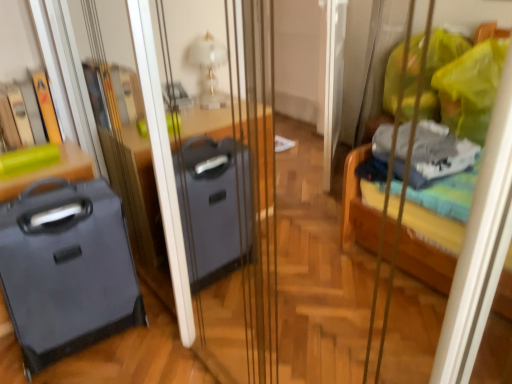
Question: Should I look upward or downward to see matte black suitcase at left?

Choices:
 (A) up
 (B) down

Answer: (B)

Question: Can you confirm if green matte suitcase at left is bigger than matte black suitcase at left?

Choices:
 (A) no
 (B) yes

Answer: (A)

Question: Is green matte suitcase at left positioned beyond the bounds of matte black suitcase at left?

Choices:
 (A) no
 (B) yes

Answer: (B)

Question: From a real-world perspective, does green matte suitcase at left stand above matte black suitcase at left?

Choices:
 (A) yes
 (B) no

Answer: (A)

Question: Considering the relative positions of green matte suitcase at left and matte black suitcase at left in the image provided, is green matte suitcase at left to the left of matte black suitcase at left from the viewer's perspective?

Choices:
 (A) no
 (B) yes

Answer: (B)

Question: Is green matte suitcase at left next to matte black suitcase at left?

Choices:
 (A) no
 (B) yes

Answer: (A)

Question: From the image's perspective, is green matte suitcase at left over matte black suitcase at left?

Choices:
 (A) no
 (B) yes

Answer: (B)

Question: From a real-world perspective, is matte black suitcase at left on green matte suitcase at left?

Choices:
 (A) yes
 (B) no

Answer: (B)

Question: Does matte black suitcase at left come behind green matte suitcase at left?

Choices:
 (A) no
 (B) yes

Answer: (A)

Question: Does matte black suitcase at left appear on the left side of green matte suitcase at left?

Choices:
 (A) no
 (B) yes

Answer: (A)

Question: From a real-world perspective, is matte black suitcase at left below green matte suitcase at left?

Choices:
 (A) no
 (B) yes

Answer: (B)

Question: Are matte black suitcase at left and green matte suitcase at left beside each other?

Choices:
 (A) no
 (B) yes

Answer: (A)

Question: From the image's perspective, does matte black suitcase at left appear lower than green matte suitcase at left?

Choices:
 (A) yes
 (B) no

Answer: (A)

Question: From their relative heights in the image, would you say matte black suitcase at left is taller or shorter than green matte suitcase at left?

Choices:
 (A) short
 (B) tall

Answer: (B)